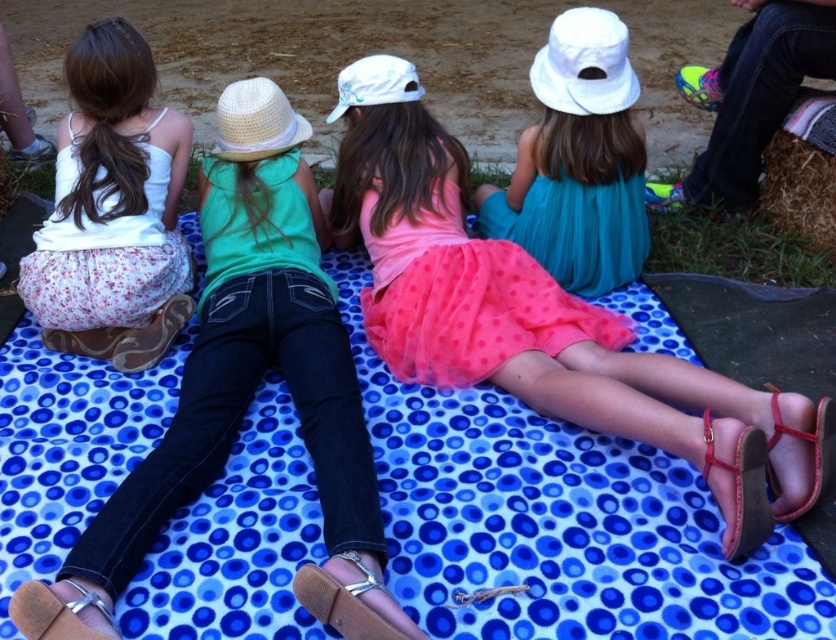
Is point (569, 282) less distant than point (19, 589)?

No, (569, 282) is further to viewer.

Between white matte bucket hat at upper center and brown leather sandal at lower left, which one has more height?

Result: Standing taller between the two is white matte bucket hat at upper center.

Is point (528, 179) positioned after point (54, 636)?

Yes.

I want to click on white matte bucket hat at upper center, so click(x=579, y=161).

Which of these two, blue dotted fabric at center or red leather sandal at lower right, stands taller?

blue dotted fabric at center

Does blue dotted fabric at center appear over red leather sandal at lower right?

Correct, blue dotted fabric at center is located above red leather sandal at lower right.

Between point (566, 625) and point (824, 426), which one is positioned behind?

The point (824, 426) is more distant.

The width and height of the screenshot is (836, 640). What are the coordinates of `blue dotted fabric at center` in the screenshot? It's located at (558, 522).

You are a GUI agent. You are given a task and a screenshot of the screen. Output one action in this format:
    pyautogui.click(x=<x>, y=<y>)
    Task: Click on the blue dotted fabric at center
    This screenshot has width=836, height=640.
    Given the screenshot: What is the action you would take?
    pyautogui.click(x=558, y=522)

Is point (676, 547) less distant than point (554, 209)?

Yes, it is in front of point (554, 209).

At what (x,y) coordinates should I click in order to perform the action: click on blue dotted fabric at center. Please return your answer as a coordinate pair (x, y). Looking at the image, I should click on (558, 522).

Identify the location of blue dotted fabric at center. (558, 522).